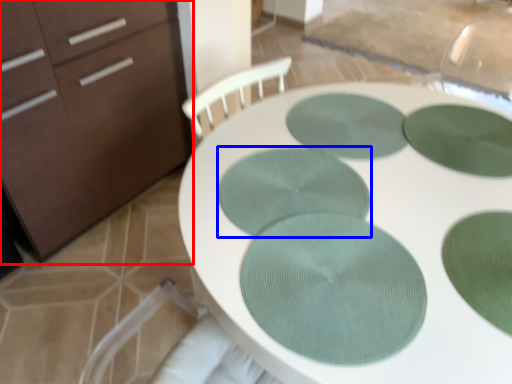
Question: Which object is closer to the camera taking this photo, chest of drawers (highlighted by a red box) or glass plate (highlighted by a blue box)?

Choices:
 (A) chest of drawers
 (B) glass plate

Answer: (B)